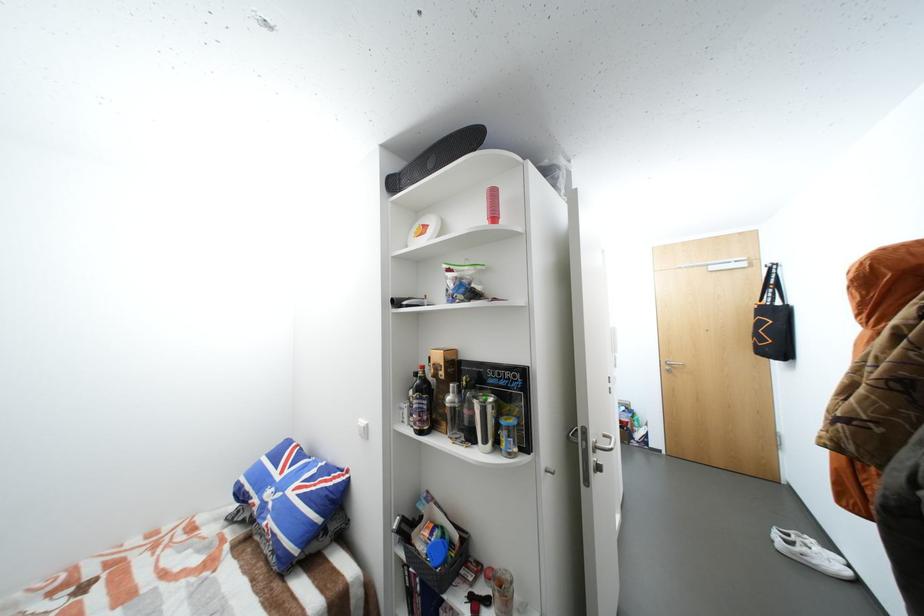
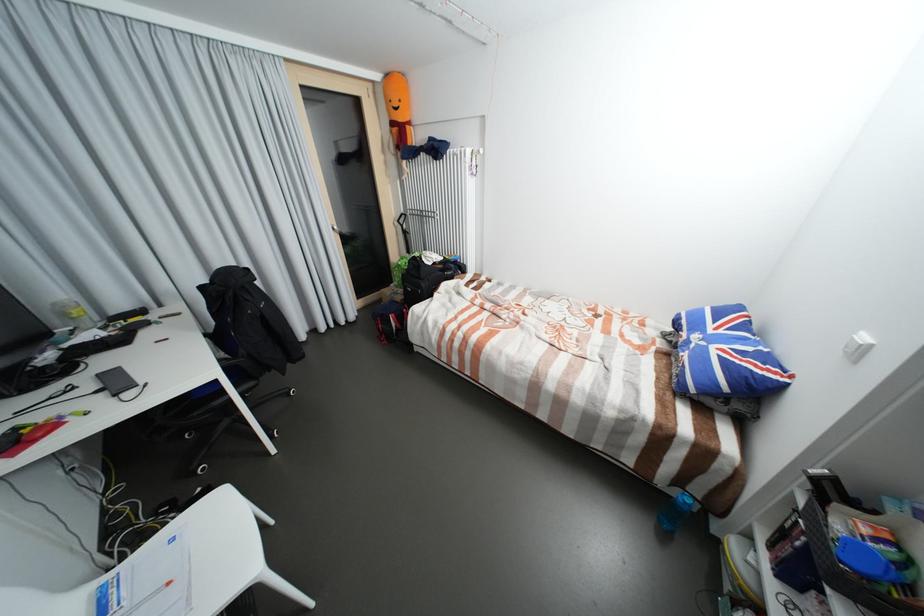
In the scene shown: The images are taken continuously from a first-person perspective. In which direction is your viewpoint rotating?

The rotation direction of the camera is left-down.